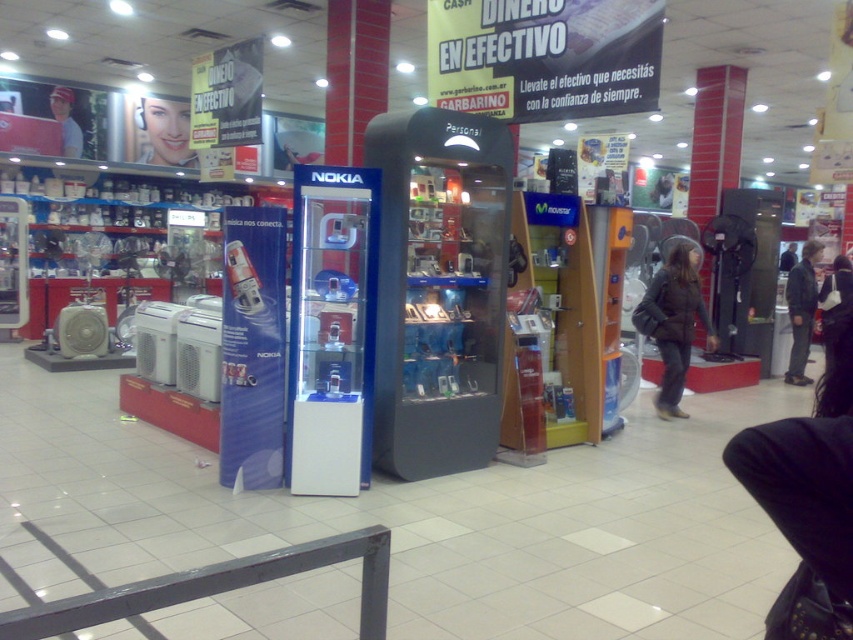
Which is below, black leather jacket at center or dark gray jacket at center?

black leather jacket at center

Can you confirm if black leather jacket at center is smaller than dark gray jacket at center?

No, black leather jacket at center is not smaller than dark gray jacket at center.

What do you see at coordinates (672, 323) in the screenshot?
I see `black leather jacket at center` at bounding box center [672, 323].

The image size is (853, 640). I want to click on black leather jacket at center, so click(672, 323).

Does dark gray jacket at center appear on the left side of matte black phone at upper left?

No, dark gray jacket at center is not to the left of matte black phone at upper left.

Can you confirm if dark gray jacket at center is shorter than matte black phone at upper left?

In fact, dark gray jacket at center may be taller than matte black phone at upper left.

Which is in front, point (813, 301) or point (67, 106)?

Positioned in front is point (813, 301).

This screenshot has height=640, width=853. Find the location of `dark gray jacket at center`. dark gray jacket at center is located at coordinates (801, 310).

In the scene shown: Is black leather jacket at center below matte black face at upper left?

Yes, black leather jacket at center is below matte black face at upper left.

Which is more to the left, black leather jacket at center or matte black face at upper left?

matte black face at upper left is more to the left.

Is point (677, 243) more distant than point (136, 154)?

No, (677, 243) is in front of (136, 154).

Identify the location of black leather jacket at center. (672, 323).